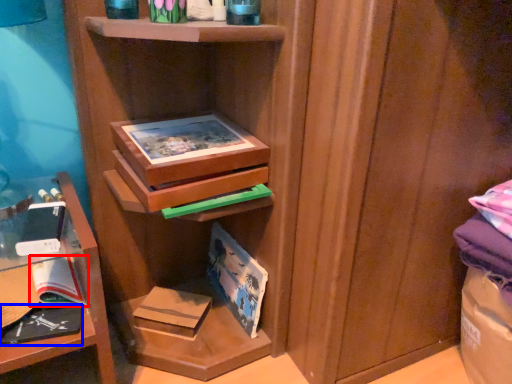
Question: Which object appears farthest to the camera in this image, paperback book (highlighted by a red box) or book (highlighted by a blue box)?

Choices:
 (A) paperback book
 (B) book

Answer: (A)